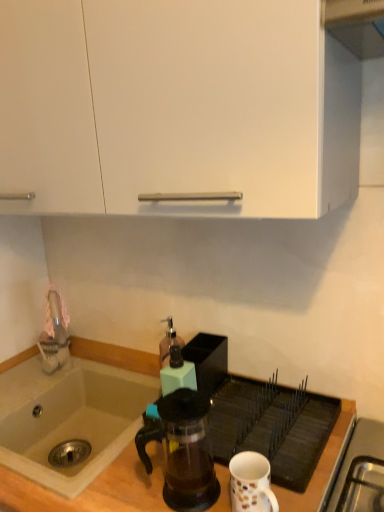
Question: Is translucent glass soap dispenser at center, arranged as the 2th kitchen appliance when viewed from the front, turned away from matte plastic soap dispenser at center, the 2th kitchen appliance in the back-to-front sequence?

Choices:
 (A) yes
 (B) no

Answer: (B)

Question: Does translucent glass soap dispenser at center, acting as the 1th kitchen appliance starting from the back, have a greater height compared to matte plastic soap dispenser at center, the 2th kitchen appliance in the back-to-front sequence?

Choices:
 (A) no
 (B) yes

Answer: (B)

Question: Does translucent glass soap dispenser at center, arranged as the 2th kitchen appliance when viewed from the front, have a larger size compared to matte plastic soap dispenser at center, the 2th kitchen appliance in the back-to-front sequence?

Choices:
 (A) no
 (B) yes

Answer: (B)

Question: From a real-world perspective, is translucent glass soap dispenser at center, arranged as the 2th kitchen appliance when viewed from the front, beneath matte plastic soap dispenser at center, the 2th kitchen appliance in the back-to-front sequence?

Choices:
 (A) no
 (B) yes

Answer: (B)

Question: Does translucent glass soap dispenser at center, acting as the 1th kitchen appliance starting from the back, have a lesser height compared to matte plastic soap dispenser at center, the 2th kitchen appliance in the back-to-front sequence?

Choices:
 (A) no
 (B) yes

Answer: (A)

Question: Is translucent glass soap dispenser at center, arranged as the 2th kitchen appliance when viewed from the front, not inside matte plastic soap dispenser at center, the 2th kitchen appliance in the back-to-front sequence?

Choices:
 (A) yes
 (B) no

Answer: (A)

Question: Does transparent glass coffee maker at center have a lesser width compared to white ceramic mug at lower right?

Choices:
 (A) yes
 (B) no

Answer: (B)

Question: Can you confirm if transparent glass coffee maker at center is wider than white ceramic mug at lower right?

Choices:
 (A) yes
 (B) no

Answer: (A)

Question: Is transparent glass coffee maker at center smaller than white ceramic mug at lower right?

Choices:
 (A) no
 (B) yes

Answer: (A)

Question: Considering the relative positions of transparent glass coffee maker at center and white ceramic mug at lower right in the image provided, is transparent glass coffee maker at center to the left of white ceramic mug at lower right from the viewer's perspective?

Choices:
 (A) yes
 (B) no

Answer: (A)

Question: Is the position of transparent glass coffee maker at center less distant than that of white ceramic mug at lower right?

Choices:
 (A) no
 (B) yes

Answer: (A)

Question: Is transparent glass coffee maker at center next to white ceramic mug at lower right?

Choices:
 (A) no
 (B) yes

Answer: (A)

Question: Considering the relative sizes of matte plastic soap dispenser at center, the 2th kitchen appliance in the back-to-front sequence, and wooden counter top at lower center in the image provided, is matte plastic soap dispenser at center, the 2th kitchen appliance in the back-to-front sequence, thinner than wooden counter top at lower center?

Choices:
 (A) no
 (B) yes

Answer: (B)